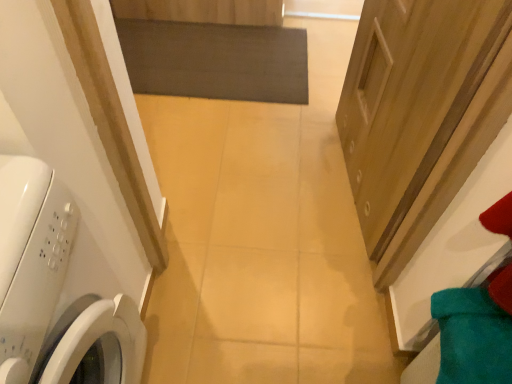
At what (x,y) coordinates should I click in order to perform the action: click on vacant space behind wooden door at right. Please return your answer as a coordinate pair (x, y). The height and width of the screenshot is (384, 512). Looking at the image, I should click on (307, 117).